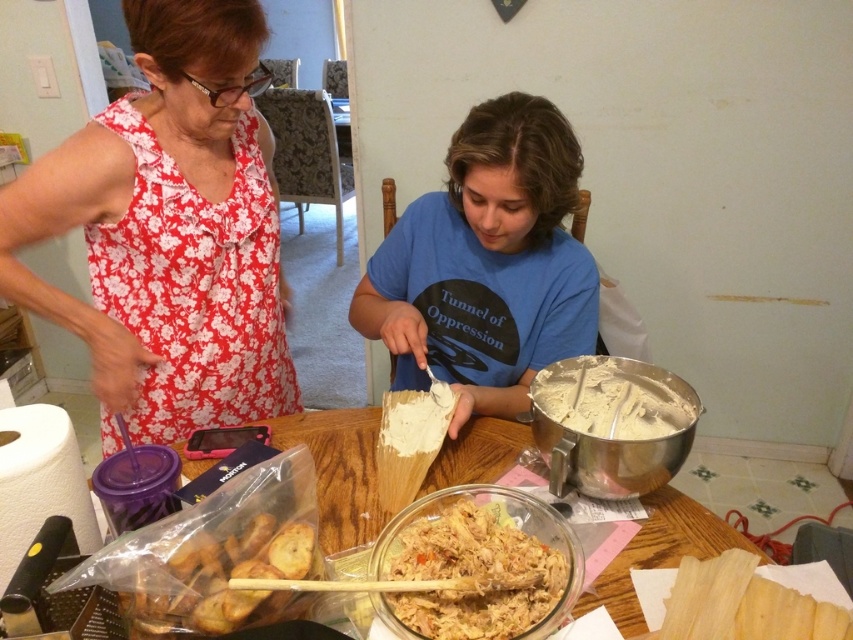
What is the object located at the coordinate point (169, 230) in the image?

The object at coordinate point (169, 230) is the floral fabric dress at upper left.

You are organizing a kitchen pantry and need to stack the translucent plastic bag at lower left and the translucent plastic bag of breadsticks at lower left vertically. Which one should you place at the bottom to ensure stability?

The translucent plastic bag at lower left is taller than the translucent plastic bag of breadsticks at lower left. To ensure stability, place the taller bag at the bottom since it has a larger base area.

You are standing in the kitchen and see two points marked in the scene. Which point, point (x=463, y=129) or point (x=491, y=497), is closer to you?

Point (x=463, y=129) is closer to you because it is further to the viewer than point (x=491, y=497).